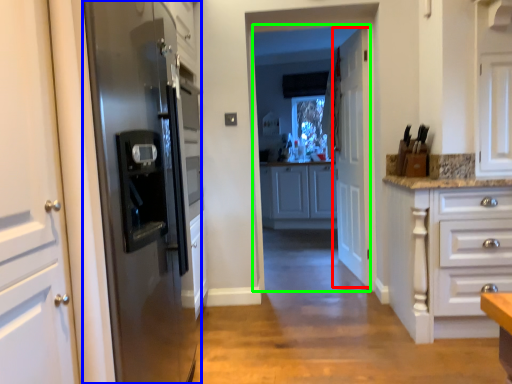
Question: Which object is the closest to the door (highlighted by a red box)? Choose among these: refrigerator (highlighted by a blue box) or glass door (highlighted by a green box).

Choices:
 (A) refrigerator
 (B) glass door

Answer: (A)